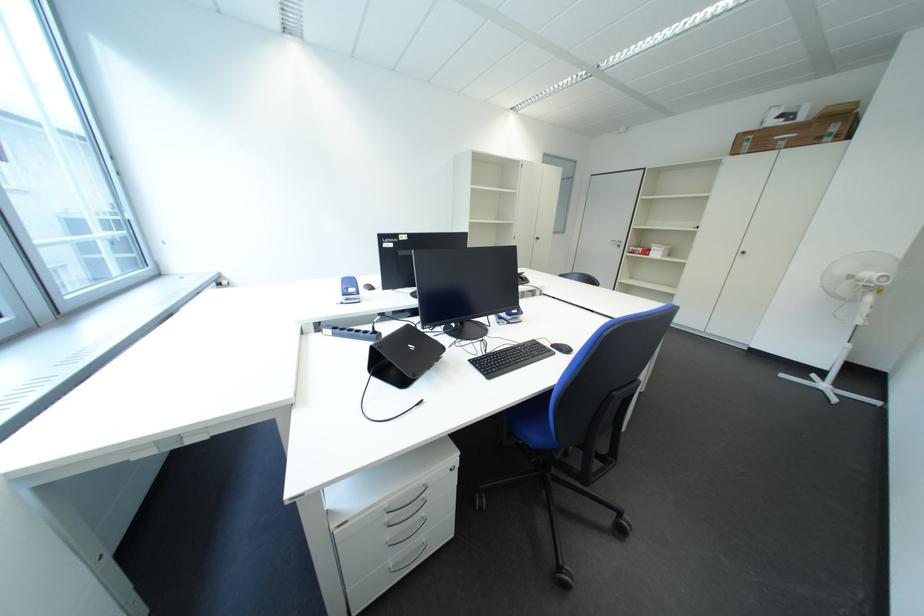
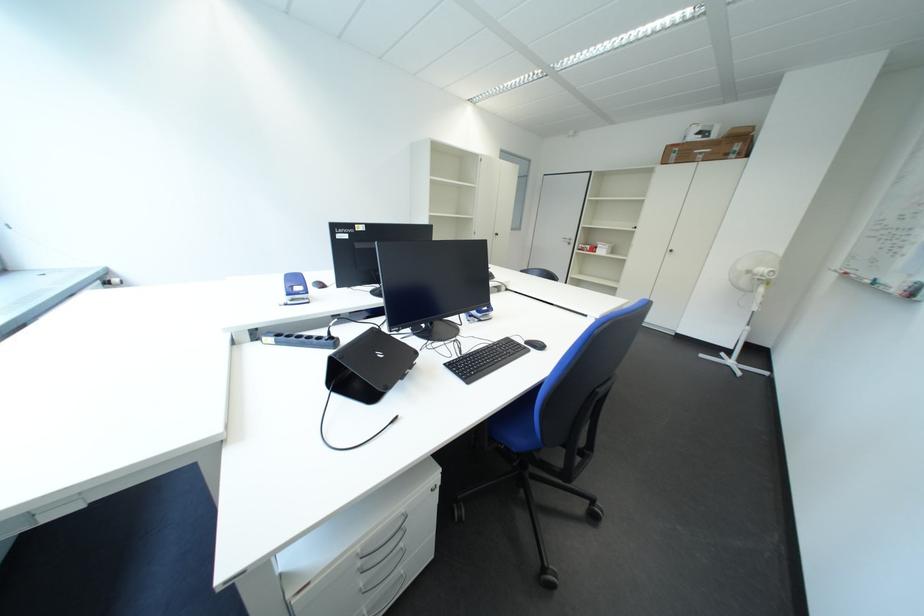
Find the pixel in the second image that matches pixel 399 521 in the first image.

(371, 565)